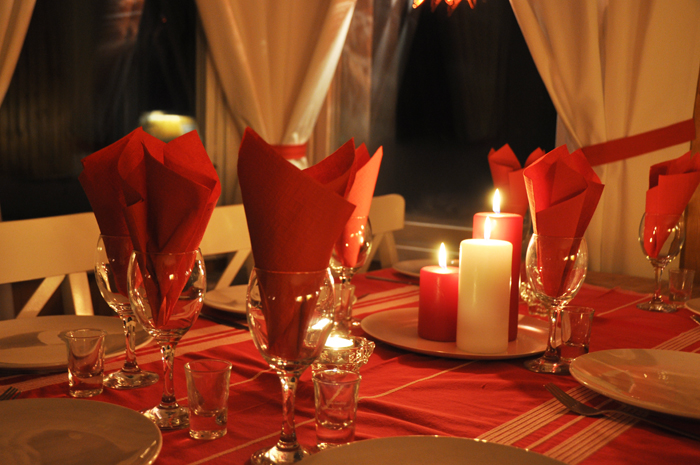
You are a GUI agent. You are given a task and a screenshot of the screen. Output one action in this format:
    pyautogui.click(x=<x>, y=<y>)
    Task: Click on the wine glasses with red folded paper napkins
    
    Given the screenshot: What is the action you would take?
    pyautogui.click(x=666, y=245), pyautogui.click(x=546, y=274), pyautogui.click(x=279, y=309), pyautogui.click(x=158, y=301), pyautogui.click(x=108, y=284), pyautogui.click(x=355, y=243)